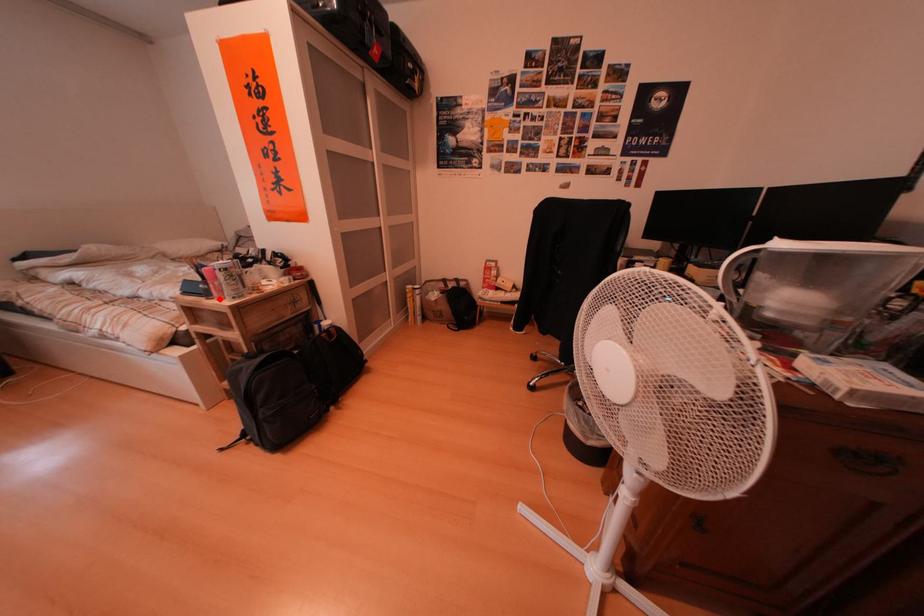
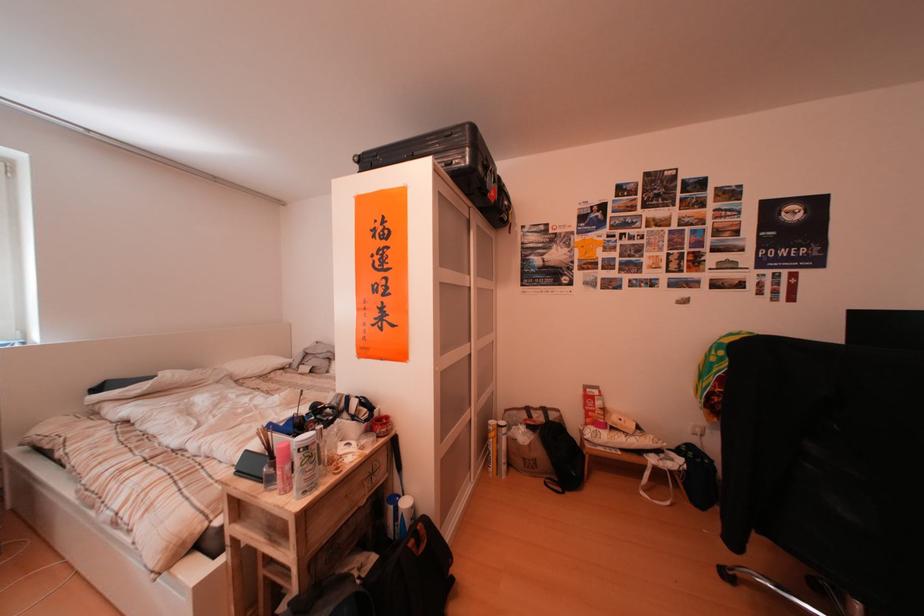
Question: I am providing you with two images of the same scene from different viewpoints. In image1, a red point is highlighted. Considering the same 3D point in image2, which of the following is correct?

Choices:
 (A) It is closer
 (B) It is farther

Answer: (B)